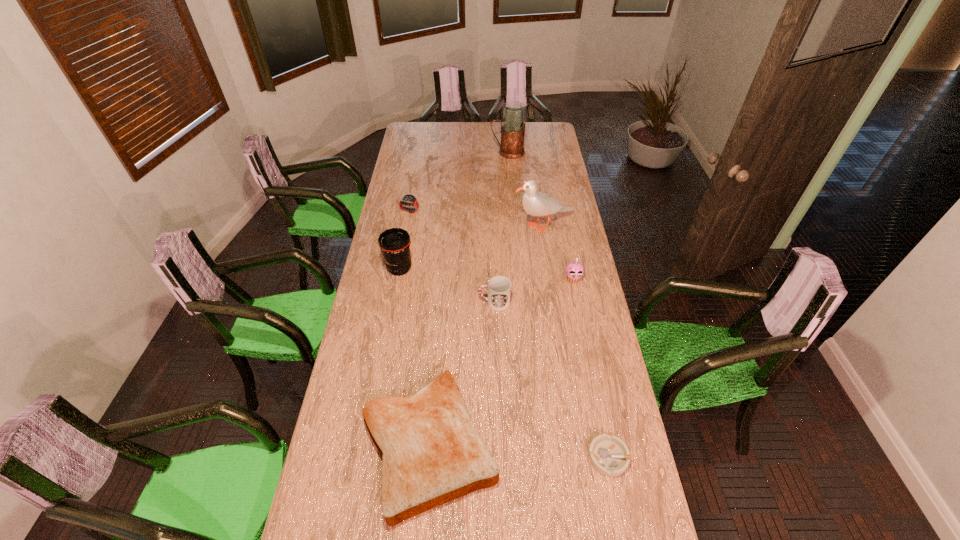
In the image, there is a desktop. Identify the location of free space at the right edge. (547, 166).

This screenshot has height=540, width=960. In the image, there is a desktop. What are the coordinates of `vacant space at the far left corner` in the screenshot? It's located at (419, 140).

Find the location of a particular element. free spot between the cupcake and the shortest object is located at coordinates (591, 368).

Locate an element on the screen. The image size is (960, 540). unoccupied position between the gull and the ashtray is located at coordinates (576, 341).

Where is `empty space that is in between the bread and the cup`? Image resolution: width=960 pixels, height=540 pixels. empty space that is in between the bread and the cup is located at coordinates (462, 374).

At what (x,y) coordinates should I click in order to perform the action: click on empty space that is in between the bread and the telephoto lens. Please return your answer as a coordinate pair (x, y). This screenshot has width=960, height=540. Looking at the image, I should click on (415, 357).

Locate an element on the screen. The image size is (960, 540). free space between the ashtray and the cup is located at coordinates (552, 380).

The height and width of the screenshot is (540, 960). I want to click on free space between the bread and the cupcake, so click(x=501, y=362).

Locate an element on the screen. blank region between the cupcake and the cup is located at coordinates (534, 290).

Identify the location of empty space between the farthest object and the ashtray. (559, 305).